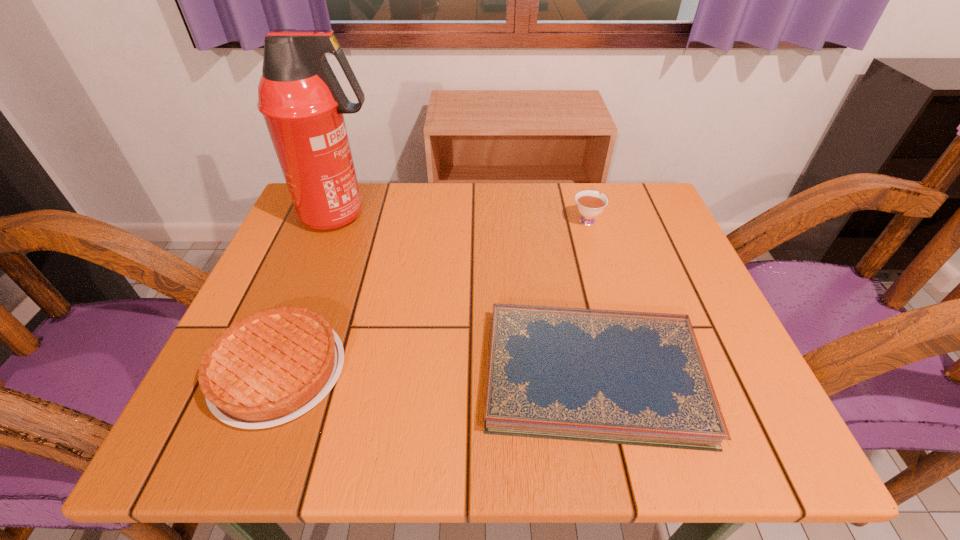
The height and width of the screenshot is (540, 960). I want to click on object that is at the far right corner, so click(589, 203).

What are the coordinates of `object situated at the near right corner` in the screenshot? It's located at (639, 378).

Locate an element on the screen. The image size is (960, 540). free region at the far edge of the desktop is located at coordinates (585, 184).

At what (x,y) coordinates should I click in order to perform the action: click on vacant area at the near edge of the desktop. Please return your answer as a coordinate pair (x, y). Looking at the image, I should click on (478, 425).

In the image, there is a desktop. Where is `vacant space at the left edge`? vacant space at the left edge is located at coordinates (263, 300).

At what (x,y) coordinates should I click in order to perform the action: click on vacant region at the right edge of the desktop. Please return your answer as a coordinate pair (x, y). Looking at the image, I should click on (697, 278).

Find the location of a particular element. vacant space at the far left corner is located at coordinates (309, 236).

Where is `blank space at the near left corner of the desktop`? blank space at the near left corner of the desktop is located at coordinates (252, 453).

Locate an element on the screen. The width and height of the screenshot is (960, 540). free region at the far right corner of the desktop is located at coordinates (621, 224).

This screenshot has width=960, height=540. What are the coordinates of `vacant area that lies between the paperback book and the second shortest object` in the screenshot? It's located at (436, 373).